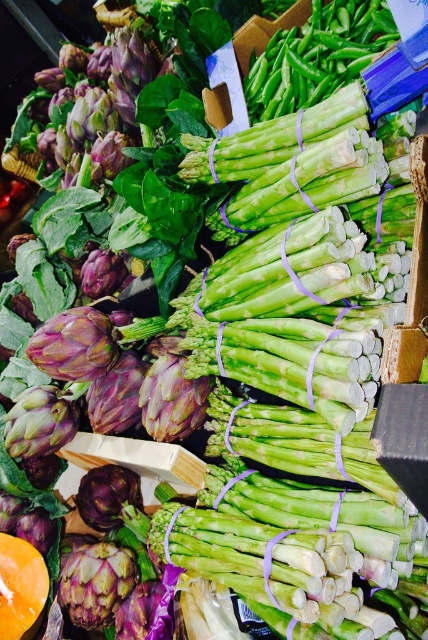
Question: Does purple matte artichoke at center-left appear on the right side of purple matte artichoke at center?

Choices:
 (A) no
 (B) yes

Answer: (A)

Question: Which object appears closest to the camera in this image?

Choices:
 (A) purple matte artichoke at center
 (B) purple matte artichoke at center-left

Answer: (B)

Question: Which object appears closest to the camera in this image?

Choices:
 (A) purple matte artichoke at center-left
 (B) purple matte artichoke at center

Answer: (A)

Question: Is the position of purple matte artichoke at center-left less distant than that of purple matte artichoke at center?

Choices:
 (A) yes
 (B) no

Answer: (A)

Question: Is purple matte artichoke at center-left wider than purple matte artichoke at center?

Choices:
 (A) yes
 (B) no

Answer: (A)

Question: Which of the following is the closest to the observer?

Choices:
 (A) (83, 627)
 (B) (94, 490)

Answer: (A)